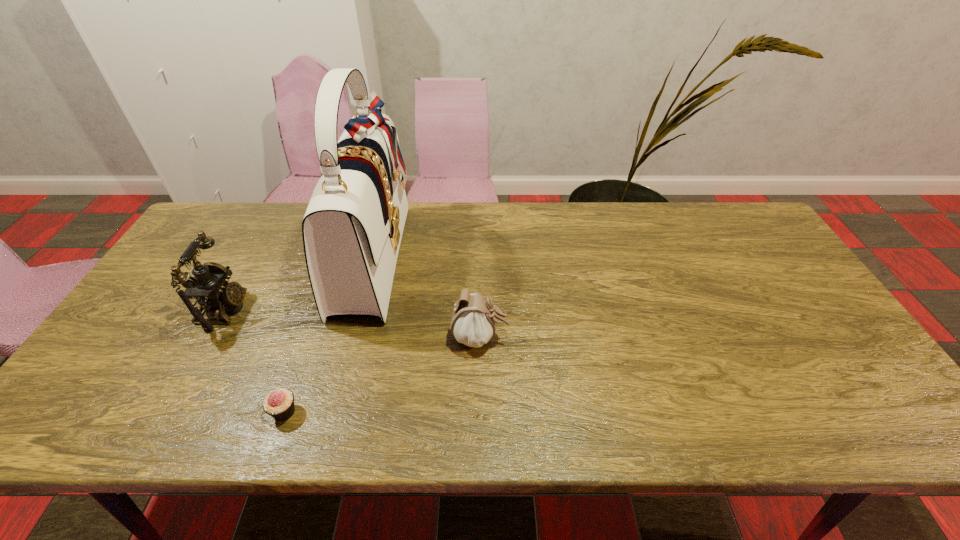
What are the coordinates of `vacant area between the second tallest object and the nearest object` in the screenshot? It's located at (254, 361).

Locate an element on the screen. This screenshot has height=540, width=960. vacant point located between the rightmost object and the nearest object is located at coordinates (382, 375).

At what (x,y) coordinates should I click in order to perform the action: click on vacant space that is in between the second shortest object and the cupcake. Please return your answer as a coordinate pair (x, y). This screenshot has width=960, height=540. Looking at the image, I should click on (382, 375).

Where is `unoccupied position between the rightmost object and the cupcake`? Image resolution: width=960 pixels, height=540 pixels. unoccupied position between the rightmost object and the cupcake is located at coordinates (382, 375).

Where is `free space between the tallest object and the cupcake`? The height and width of the screenshot is (540, 960). free space between the tallest object and the cupcake is located at coordinates (328, 334).

Find the location of a particular element. Image resolution: width=960 pixels, height=540 pixels. empty location between the second shortest object and the telephone is located at coordinates (352, 324).

Locate an element on the screen. The image size is (960, 540). vacant space that is in between the second shortest object and the second tallest object is located at coordinates (352, 324).

Where is `the third closest object to the tallest object`? This screenshot has width=960, height=540. the third closest object to the tallest object is located at coordinates (279, 404).

The height and width of the screenshot is (540, 960). Identify the location of object identified as the third closest to the leftmost object. (473, 320).

Where is `vacant area in the image that satisfies the following two spatial constraints: 1. on the front-facing side of the tallest object; 2. on the front side of the nearest object`? Image resolution: width=960 pixels, height=540 pixels. vacant area in the image that satisfies the following two spatial constraints: 1. on the front-facing side of the tallest object; 2. on the front side of the nearest object is located at coordinates (331, 412).